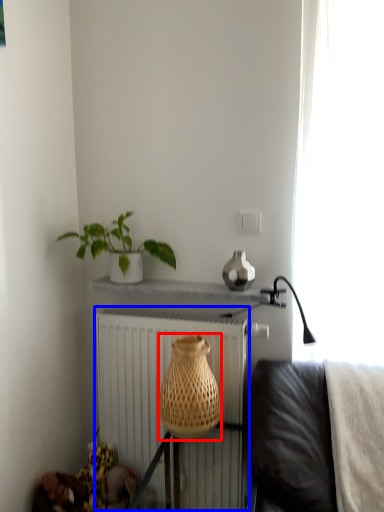
Question: Which object is further to the camera taking this photo, basket (highlighted by a red box) or radiator (highlighted by a blue box)?

Choices:
 (A) basket
 (B) radiator

Answer: (B)